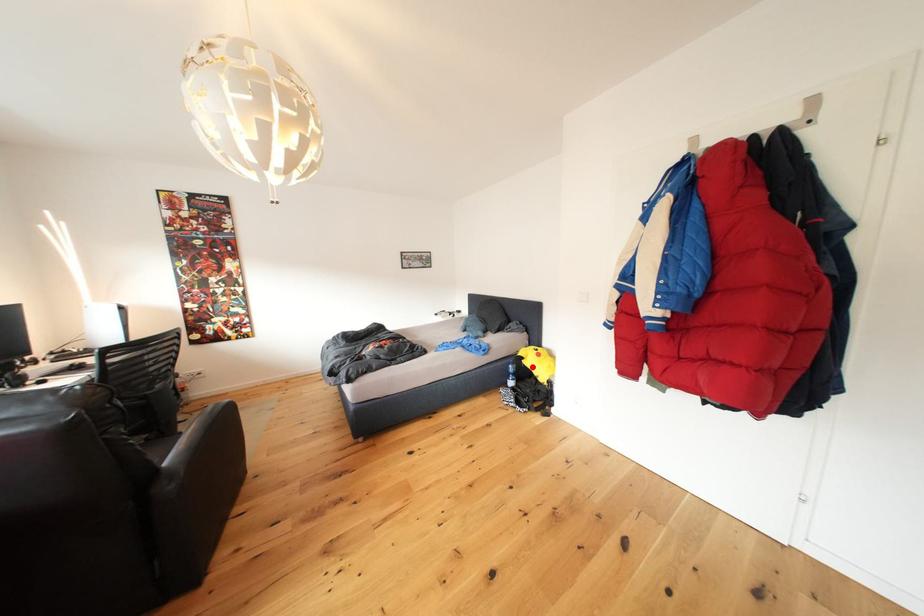
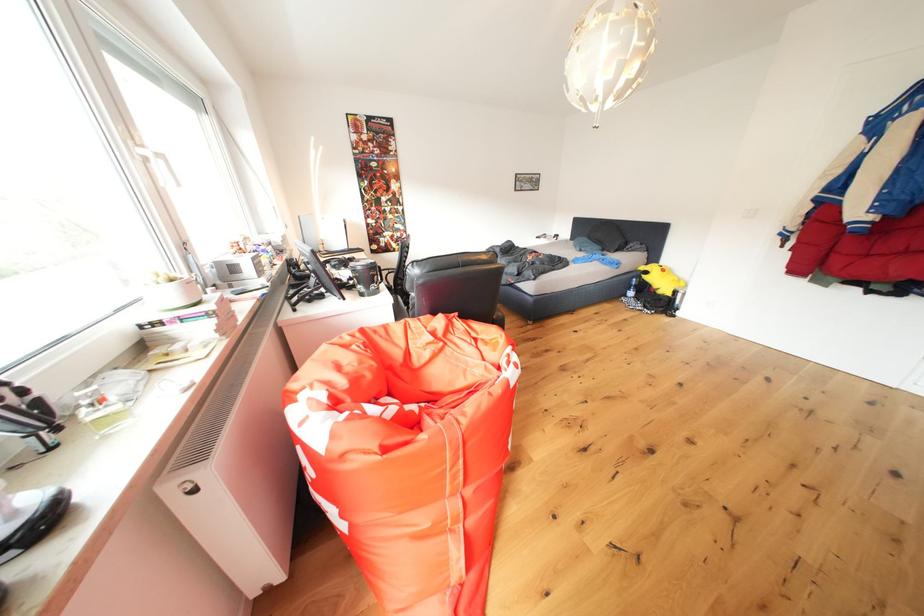
Find the pixel in the second image that matches the highlighted location in the first image.

(653, 282)